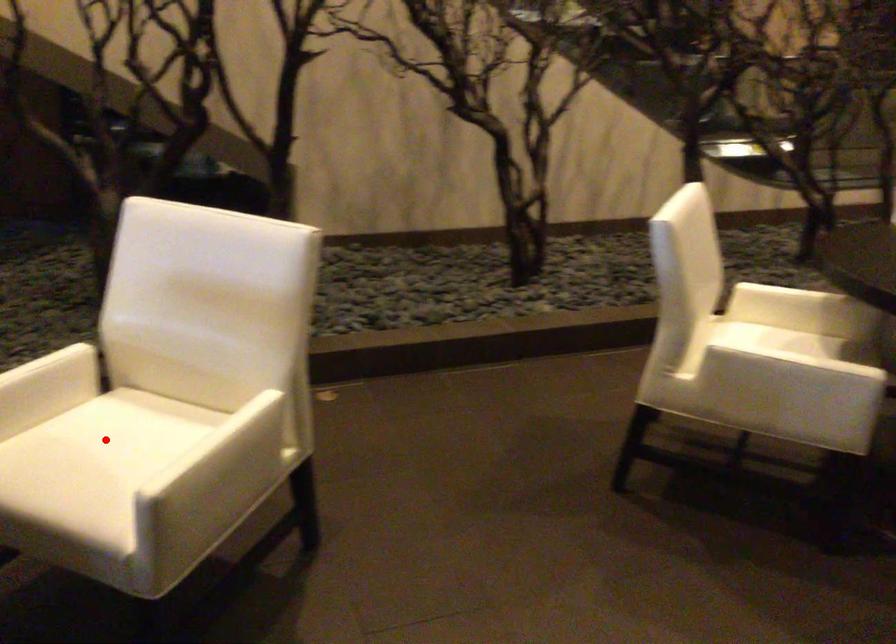
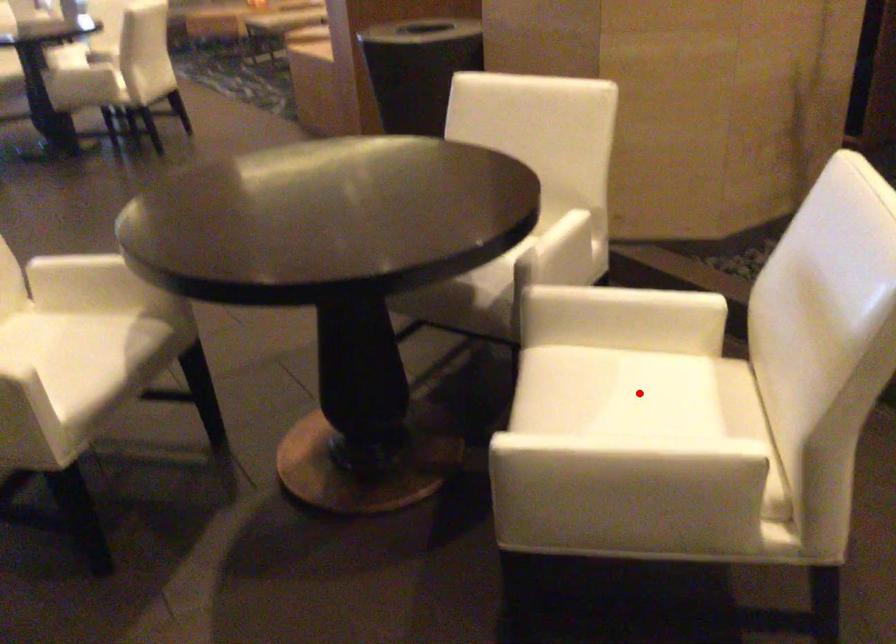
I am providing you with two images of the same scene from different viewpoints. A red point is marked on the first image and another point is marked on the second image. Is the red point in image1 aligned with the point shown in image2?

Yes